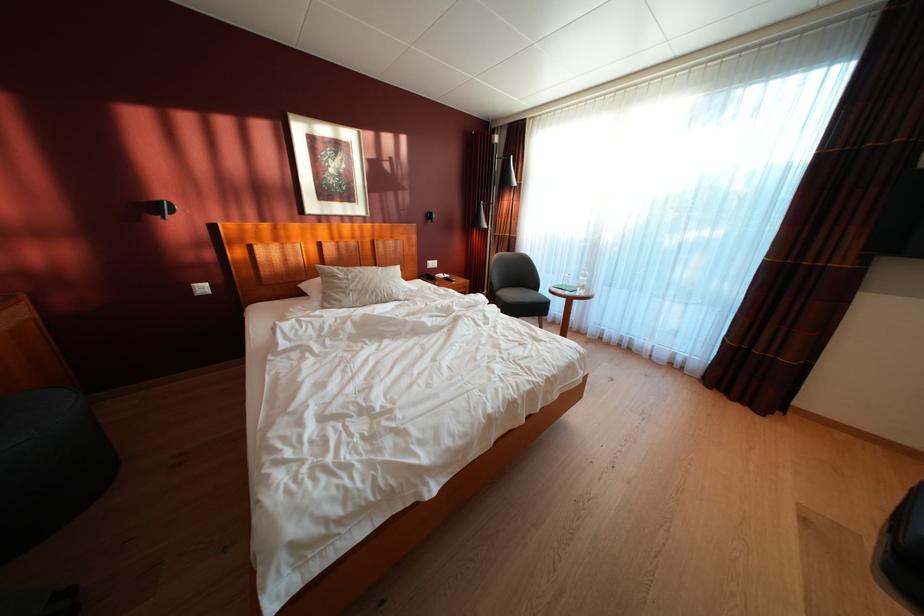
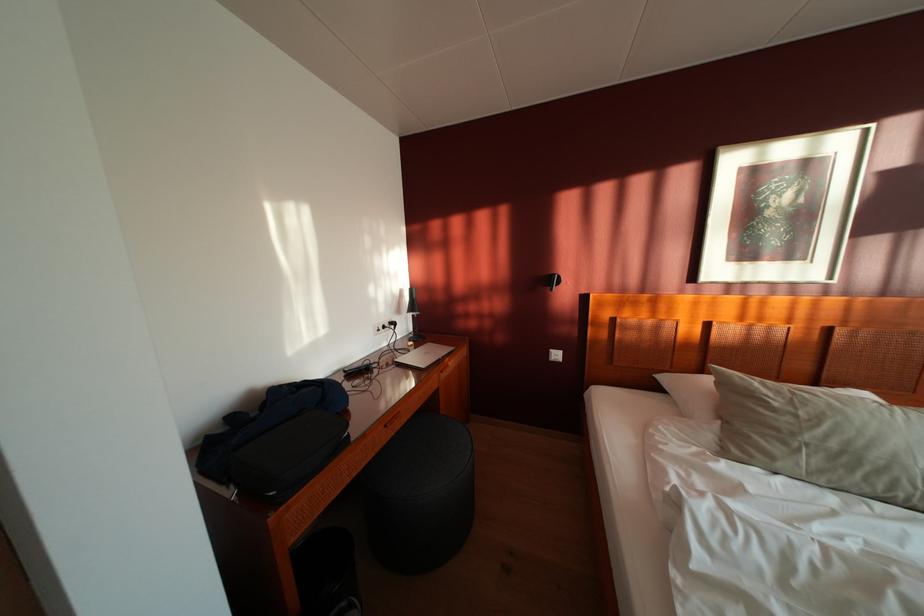
The point at (199, 294) is marked in the first image. Where is the corresponding point in the second image?

(555, 360)